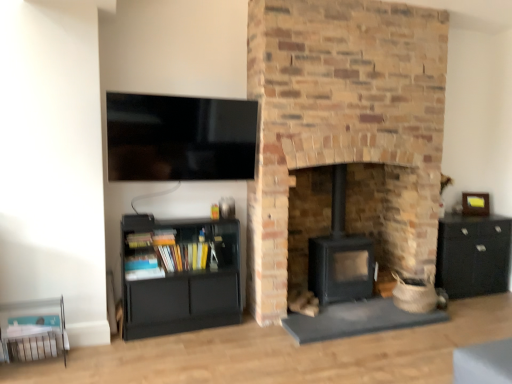
Question: Is black matte wood burning stove at center to the left or to the right of brick fireplace at center in the image?

Choices:
 (A) right
 (B) left

Answer: (B)

Question: In terms of height, does black matte wood burning stove at center look taller or shorter compared to brick fireplace at center?

Choices:
 (A) tall
 (B) short

Answer: (B)

Question: Estimate the real-world distances between objects in this image. Which object is farther from the flat screen tv at upper left?

Choices:
 (A) matte black bookshelf at lower left
 (B) black matte cabinet at right
 (C) brick fireplace at center
 (D) wooden picture frame at right
 (E) black matte wood burning stove at center

Answer: (D)

Question: Which is nearer to the black matte cabinet at right?

Choices:
 (A) matte black bookshelf at lower left
 (B) wooden picture frame at right
 (C) black matte wood burning stove at center
 (D) brick fireplace at center
 (E) flat screen tv at upper left

Answer: (B)